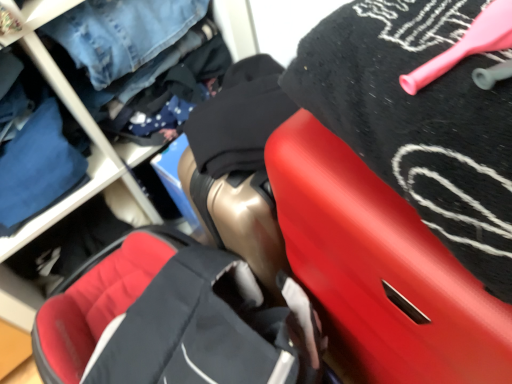
Question: Can you confirm if rubberized red suitcase at upper right is positioned to the left of blue denim jeans at upper left, which is the 2th clothing from right to left?

Choices:
 (A) no
 (B) yes

Answer: (A)

Question: From a real-world perspective, is rubberized red suitcase at upper right beneath blue denim jeans at upper left, which ranks as the 1th clothing in back-to-front order?

Choices:
 (A) no
 (B) yes

Answer: (B)

Question: Can you confirm if rubberized red suitcase at upper right is bigger than blue denim jeans at upper left, which is the 2th clothing from right to left?

Choices:
 (A) no
 (B) yes

Answer: (B)

Question: From a real-world perspective, is rubberized red suitcase at upper right located higher than blue denim jeans at upper left, the second clothing in the front-to-back sequence?

Choices:
 (A) yes
 (B) no

Answer: (B)

Question: Considering the relative positions of rubberized red suitcase at upper right and blue denim jeans at upper left, which is the 2th clothing from right to left, in the image provided, is rubberized red suitcase at upper right to the right of blue denim jeans at upper left, which is the 2th clothing from right to left, from the viewer's perspective?

Choices:
 (A) yes
 (B) no

Answer: (A)

Question: From a real-world perspective, is black matte towel at upper right, the second clothing when ordered from back to front, positioned above or below blue denim jeans at upper left, the second clothing in the front-to-back sequence?

Choices:
 (A) below
 (B) above

Answer: (B)

Question: Is point click(439, 127) positioned closer to the camera than point click(17, 177)?

Choices:
 (A) closer
 (B) farther

Answer: (A)

Question: Is black matte towel at upper right, which is the first clothing from right to left, in front of or behind blue denim jeans at upper left, which is the 2th clothing from right to left, in the image?

Choices:
 (A) behind
 (B) front

Answer: (B)

Question: From the image's perspective, is black matte towel at upper right, which is the first clothing from right to left, above or below blue denim jeans at upper left, the second clothing in the front-to-back sequence?

Choices:
 (A) below
 (B) above

Answer: (A)

Question: From a real-world perspective, relative to rubberized red suitcase at upper right, is soft fabric baby carriage at center vertically above or below?

Choices:
 (A) below
 (B) above

Answer: (A)

Question: Is soft fabric baby carriage at center to the left or to the right of rubberized red suitcase at upper right in the image?

Choices:
 (A) left
 (B) right

Answer: (A)

Question: Does point (186, 241) appear closer or farther from the camera than point (371, 296)?

Choices:
 (A) farther
 (B) closer

Answer: (A)

Question: Looking at their shapes, would you say soft fabric baby carriage at center is wider or thinner than rubberized red suitcase at upper right?

Choices:
 (A) thin
 (B) wide

Answer: (B)

Question: Is point (175, 286) closer or farther from the camera than point (45, 200)?

Choices:
 (A) farther
 (B) closer

Answer: (B)

Question: From a real-world perspective, is soft fabric baby carriage at center above or below blue denim jeans at upper left, the first clothing positioned from the left?

Choices:
 (A) above
 (B) below

Answer: (B)